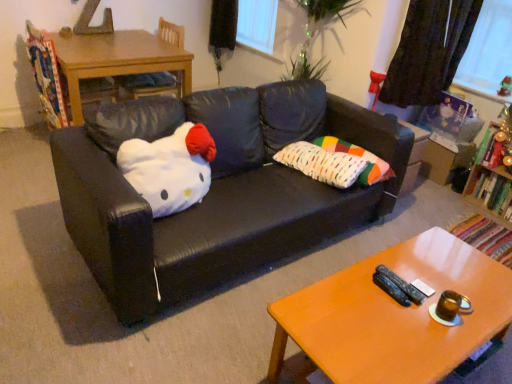
Where is `free space that is to the left of orange wood coffee table at lower right`? free space that is to the left of orange wood coffee table at lower right is located at coordinates (212, 327).